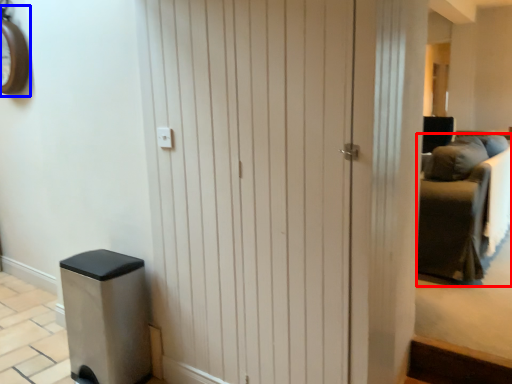
Question: Which object appears farthest to the camera in this image, furniture (highlighted by a red box) or clock (highlighted by a blue box)?

Choices:
 (A) furniture
 (B) clock

Answer: (B)